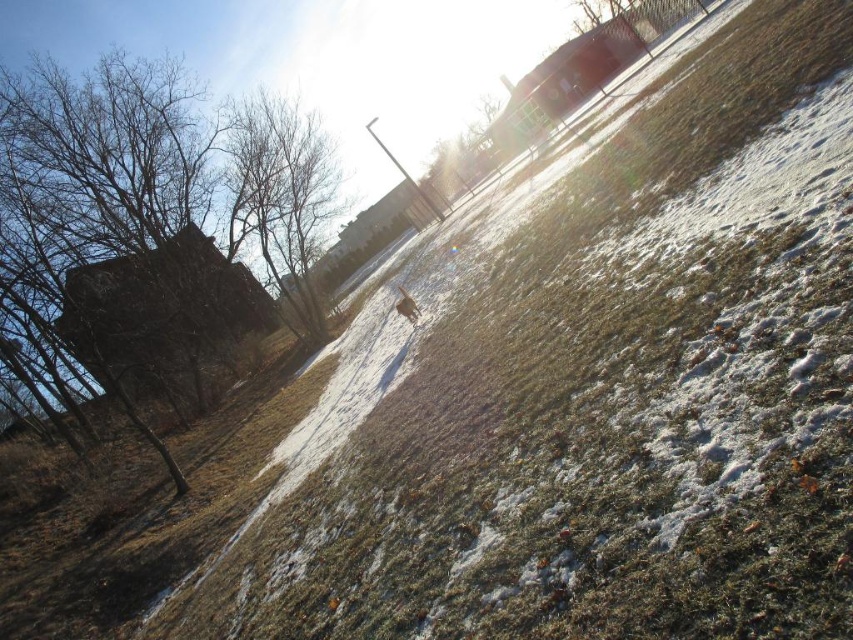
Can you confirm if brown leafless tree at upper left is wider than brown fur at center?

Yes, brown leafless tree at upper left is wider than brown fur at center.

Which is behind, point (256, 200) or point (405, 308)?

Positioned behind is point (256, 200).

Locate an element on the screen. The width and height of the screenshot is (853, 640). brown leafless tree at upper left is located at coordinates (283, 195).

Find the location of a particular element. Image resolution: width=853 pixels, height=640 pixels. brown leafless tree at upper left is located at coordinates (283, 195).

Between brown leafless tree at left and brown fur at center, which one is positioned higher?

brown leafless tree at left is higher up.

Is brown leafless tree at left behind brown fur at center?

No, it is not.

Which is in front, point (129, 157) or point (395, 301)?

Point (395, 301) is more forward.

Where is `brown leafless tree at left`? brown leafless tree at left is located at coordinates (163, 216).

Describe the element at coordinates (163, 216) in the screenshot. This screenshot has height=640, width=853. I see `brown leafless tree at left` at that location.

Is point (148, 188) closer to viewer compared to point (283, 259)?

That is True.

This screenshot has height=640, width=853. In order to click on brown leafless tree at left in this screenshot , I will do tap(163, 216).